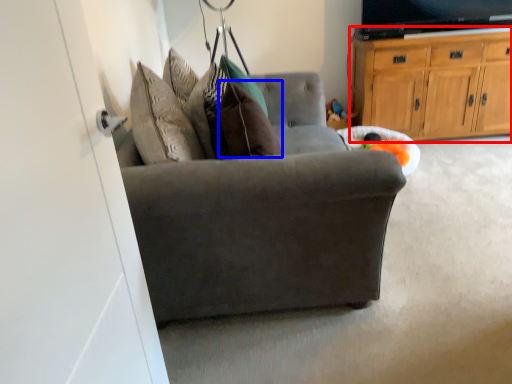
Question: Which object appears farthest to the camera in this image, cabinetry (highlighted by a red box) or pillow (highlighted by a blue box)?

Choices:
 (A) cabinetry
 (B) pillow

Answer: (A)